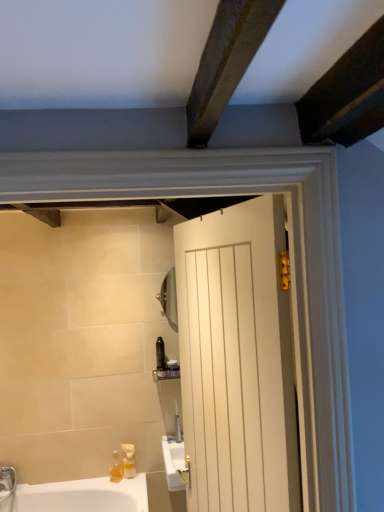
Question: Can you confirm if translucent plastic soap dispenser at lower left, acting as the 2th soap dispenser starting from the right, is shorter than translucent plastic bottle at center, the 1th toiletry positioned from the left?

Choices:
 (A) yes
 (B) no

Answer: (A)

Question: Is translucent plastic soap dispenser at lower left, acting as the 1th soap dispenser starting from the left, positioned behind translucent plastic bottle at center, the 1th toiletry positioned from the left?

Choices:
 (A) no
 (B) yes

Answer: (A)

Question: Does translucent plastic soap dispenser at lower left, acting as the 1th soap dispenser starting from the left, contain translucent plastic bottle at center, positioned as the second toiletry in right-to-left order?

Choices:
 (A) yes
 (B) no

Answer: (B)

Question: Does translucent plastic soap dispenser at lower left, acting as the 2th soap dispenser starting from the right, have a smaller size compared to translucent plastic bottle at center, the 1th toiletry positioned from the left?

Choices:
 (A) no
 (B) yes

Answer: (B)

Question: Is there a large distance between translucent plastic soap dispenser at lower left, acting as the 1th soap dispenser starting from the left, and translucent plastic bottle at center, positioned as the second toiletry in right-to-left order?

Choices:
 (A) yes
 (B) no

Answer: (B)

Question: From a real-world perspective, is translucent plastic soap dispenser at lower left, acting as the 2th soap dispenser starting from the right, on translucent plastic bottle at center, the 1th toiletry positioned from the left?

Choices:
 (A) no
 (B) yes

Answer: (A)

Question: Can you confirm if white wooden door at center is bigger than translucent plastic bottle at center, positioned as the second toiletry in right-to-left order?

Choices:
 (A) no
 (B) yes

Answer: (B)

Question: Considering the relative sizes of white wooden door at center and translucent plastic bottle at center, positioned as the second toiletry in right-to-left order, in the image provided, is white wooden door at center shorter than translucent plastic bottle at center, positioned as the second toiletry in right-to-left order,?

Choices:
 (A) yes
 (B) no

Answer: (B)

Question: From a real-world perspective, does white wooden door at center stand above translucent plastic bottle at center, positioned as the second toiletry in right-to-left order?

Choices:
 (A) no
 (B) yes

Answer: (B)

Question: Can you confirm if white wooden door at center is smaller than translucent plastic bottle at center, positioned as the second toiletry in right-to-left order?

Choices:
 (A) no
 (B) yes

Answer: (A)

Question: Is white wooden door at center outside of translucent plastic bottle at center, the 1th toiletry positioned from the left?

Choices:
 (A) yes
 (B) no

Answer: (A)

Question: Does white wooden door at center have a greater height compared to translucent plastic bottle at center, the 1th toiletry positioned from the left?

Choices:
 (A) no
 (B) yes

Answer: (B)

Question: From the image's perspective, is translucent yellow plastic at lower left, placed as the 1th soap dispenser when sorted from right to left, on translucent plastic bottle at center, the 1th toiletry positioned from the left?

Choices:
 (A) no
 (B) yes

Answer: (A)